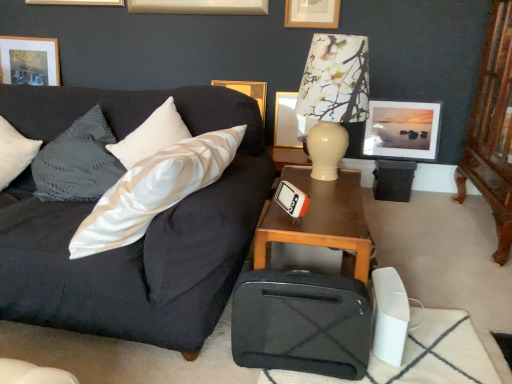
Identify the location of blank space situated above black matte suitcase at lower center (from a real-world perspective). (309, 278).